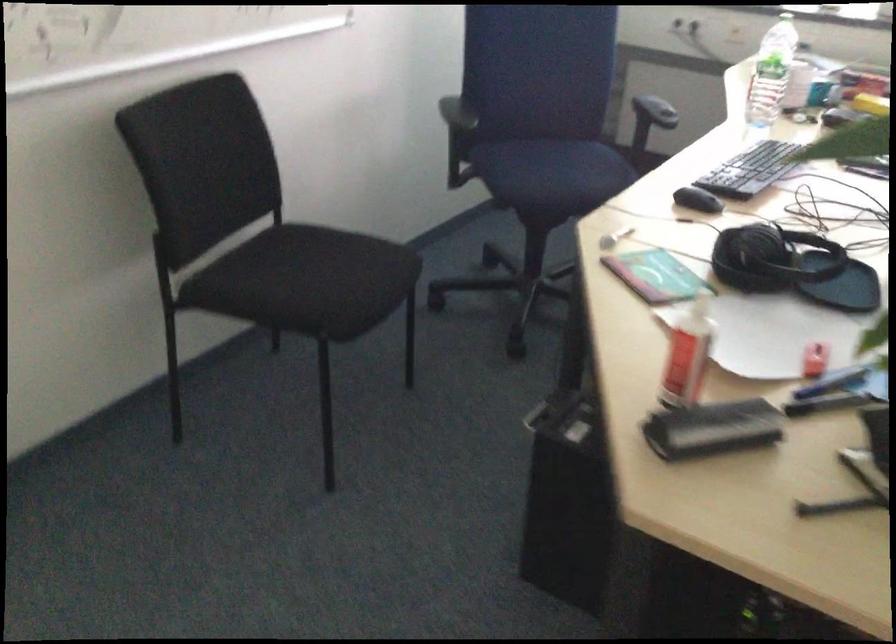
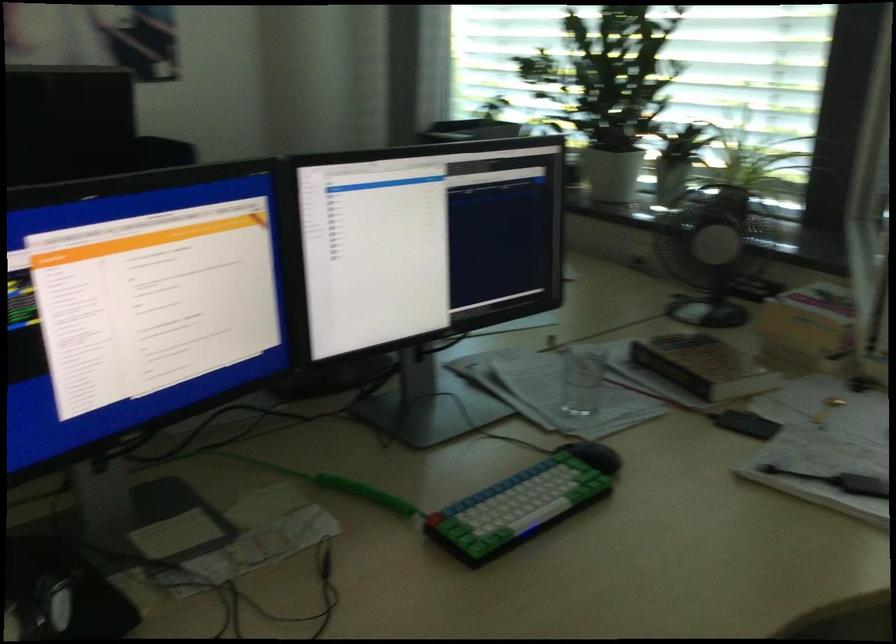
Question: The images are taken continuously from a first-person perspective. In which direction are you moving?

Choices:
 (A) Left
 (B) Right
 (C) Forward
 (D) Backward

Answer: (B)